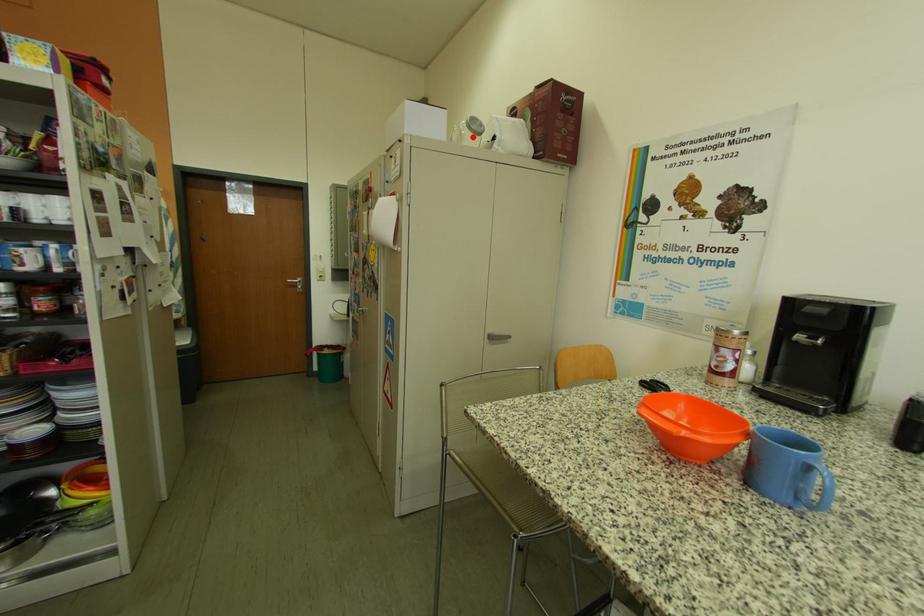
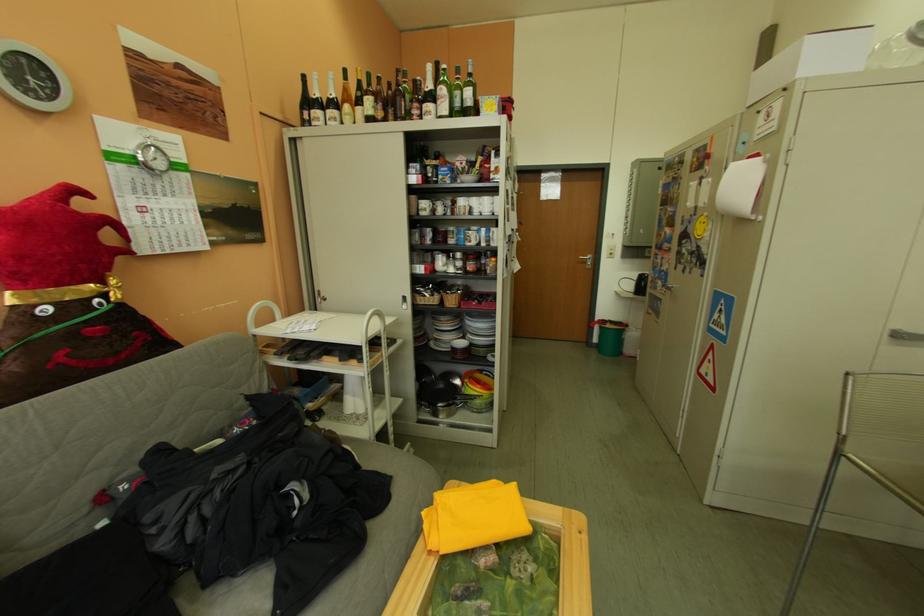
Question: I am providing you with two images of the same scene from different viewpoints. Given a red point in image1, look at the same physical point in image2. Is it:

Choices:
 (A) Closer to the viewpoint
 (B) Farther from the viewpoint

Answer: (B)